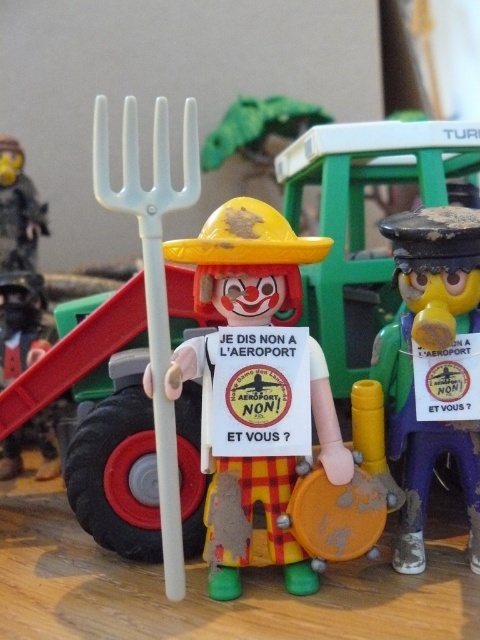
In the scene shown: You are playing with the toy figurines on the wooden surface and notice two points marked on the image. The first point is at coordinates point (178,396) and the second is at point (456,368). If you were to move from the first point to the second point, would you be moving towards the clown or away from the clown?

The point (178,396) is in front of point (456,368). Moving from the first point to the second point would mean moving away from the clown since the first point is closer to the clown than the second point.

Looking at this image, you are setting up a display and need to place the brushed metal figure at left and the brushed metal fork at upper left on a shelf. The shelf has a width limit of 10 cm. If the figure is wider than the fork, can both items fit side by side without overlapping?

The brushed metal figure at left is wider than the brushed metal fork at upper left. However, since the shelf has a 10 cm width limit and we don not know their exact widths, it is impossible to determine if both can fit without overlapping.